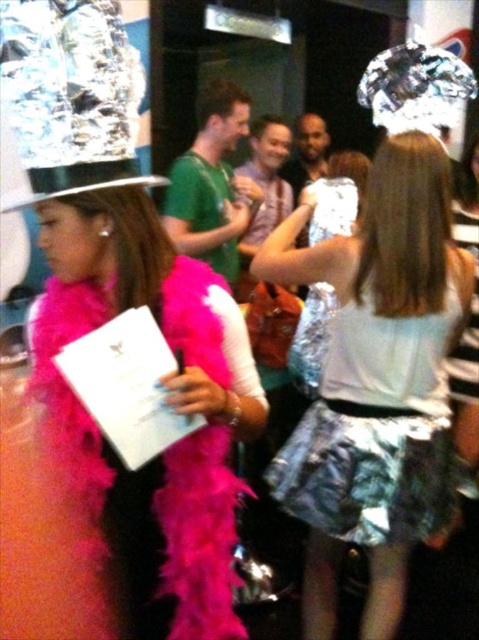
You are planning to sit between the shiny metallic dress at center and the shiny silver dress at center. Which dress will you be closer to if you choose the side where the dresses are wider?

The shiny metallic dress at center is wider than the shiny silver dress at center, so you would be closer to the shiny metallic dress at center if you sit on the side where the dresses are wider.